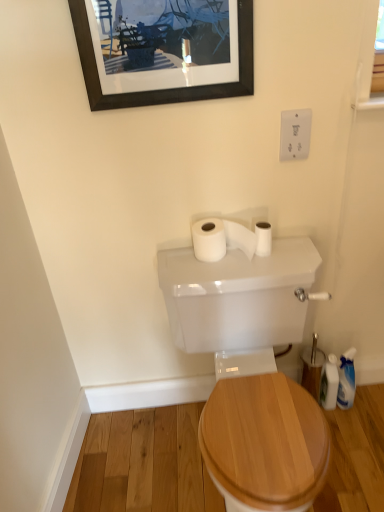
In order to click on empty space that is to the right of white matte toilet paper at upper center, placed as the 1th toilet paper when sorted from right to left in this screenshot , I will do point(291,252).